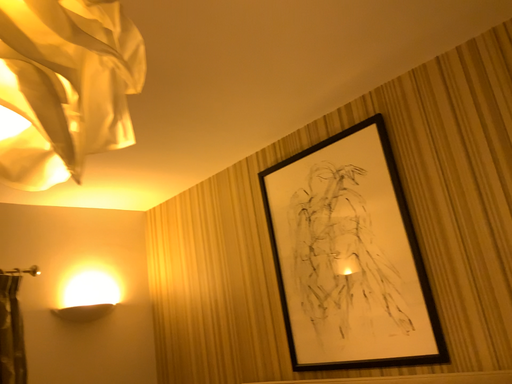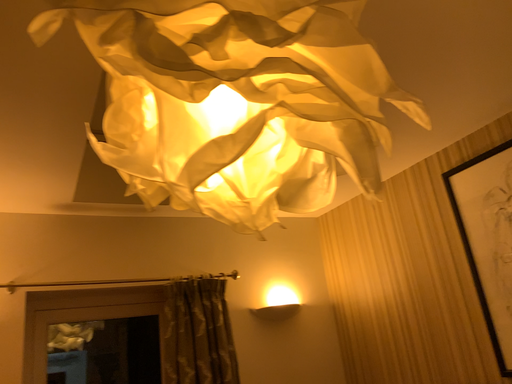
Question: How did the camera likely rotate when shooting the video?

Choices:
 (A) rotated right
 (B) rotated left

Answer: (B)